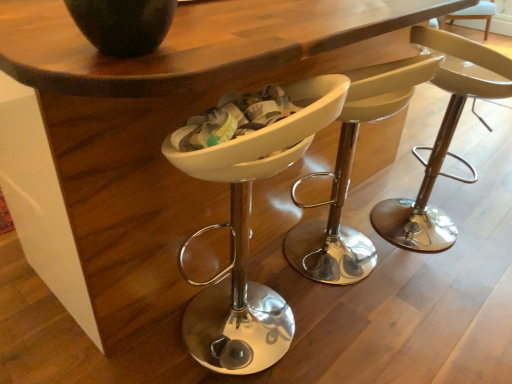
Question: Is white plastic chair at center, the 2th chair when ordered from right to left, further to camera compared to matte white bar stool at center?

Choices:
 (A) yes
 (B) no

Answer: (B)

Question: Does white plastic chair at center, the 2th chair when ordered from right to left, have a greater width compared to matte white bar stool at center?

Choices:
 (A) yes
 (B) no

Answer: (A)

Question: Are white plastic chair at center, the 2th chair when ordered from right to left, and matte white bar stool at center far apart?

Choices:
 (A) yes
 (B) no

Answer: (A)

Question: Would you say white plastic chair at center, the 2th chair when ordered from right to left, contains matte white bar stool at center?

Choices:
 (A) no
 (B) yes

Answer: (A)

Question: Does white plastic chair at center, the 2th chair when ordered from right to left, appear on the left side of matte white bar stool at center?

Choices:
 (A) yes
 (B) no

Answer: (A)

Question: From the image's perspective, is white plastic chair at center, the 2th chair when ordered from right to left, positioned above or below matte beige stool at center, the third chair when ordered from left to right?

Choices:
 (A) below
 (B) above

Answer: (A)

Question: Would you say white plastic chair at center, the 2th chair when ordered from right to left, is inside or outside matte beige stool at center, the third chair when ordered from left to right?

Choices:
 (A) outside
 (B) inside

Answer: (A)

Question: In terms of height, does white plastic chair at center, which is counted as the 2th chair, starting from the left, look taller or shorter compared to matte beige stool at center, which ranks as the first chair in right-to-left order?

Choices:
 (A) short
 (B) tall

Answer: (A)

Question: Is white plastic chair at center, the 2th chair when ordered from right to left, in front of or behind matte beige stool at center, which ranks as the first chair in right-to-left order, in the image?

Choices:
 (A) front
 (B) behind

Answer: (A)

Question: Is matte black vase at upper left bigger or smaller than matte beige stool at center, the third chair when ordered from left to right?

Choices:
 (A) big
 (B) small

Answer: (B)

Question: In the image, is matte black vase at upper left on the left side or the right side of matte beige stool at center, which ranks as the first chair in right-to-left order?

Choices:
 (A) right
 (B) left

Answer: (B)

Question: In the image, is matte black vase at upper left positioned in front of or behind matte beige stool at center, which ranks as the first chair in right-to-left order?

Choices:
 (A) front
 (B) behind

Answer: (A)

Question: From a real-world perspective, is matte black vase at upper left physically located above or below matte beige stool at center, the third chair when ordered from left to right?

Choices:
 (A) below
 (B) above

Answer: (B)

Question: Is white plastic chair at center, which ranks as the 3th chair in right-to-left order, wider or thinner than matte black vase at upper left?

Choices:
 (A) thin
 (B) wide

Answer: (B)

Question: Does point (273, 306) appear closer or farther from the camera than point (90, 31)?

Choices:
 (A) closer
 (B) farther

Answer: (B)